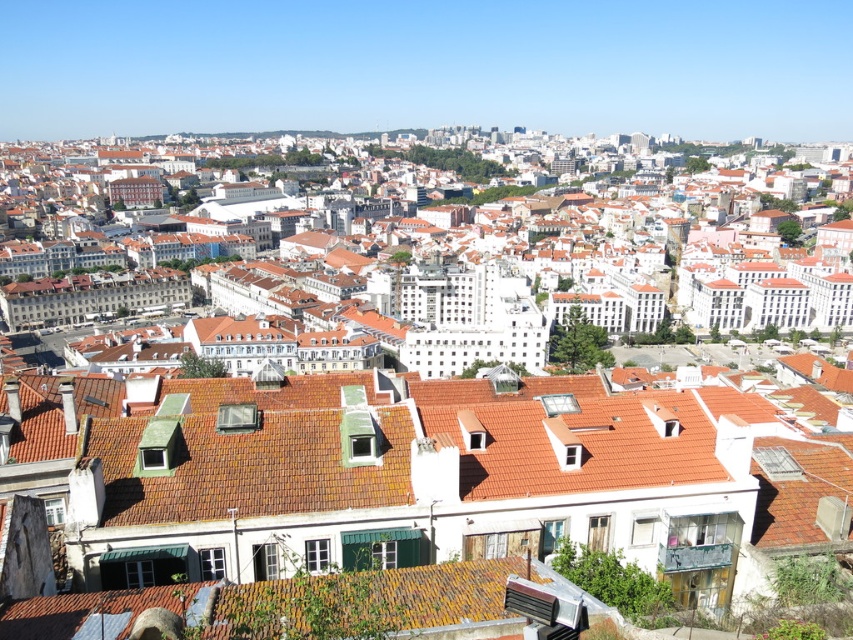
Who is lower down, brown tile roof at center or orange tiled roofs at center?

brown tile roof at center is lower down.

Between brown tile roof at center and orange tiled roofs at center, which one has less height?

Standing shorter between the two is brown tile roof at center.

Between point (389, 374) and point (817, 301), which one is positioned in front?

Point (389, 374) is in front.

Where is `brown tile roof at center`? brown tile roof at center is located at coordinates (415, 467).